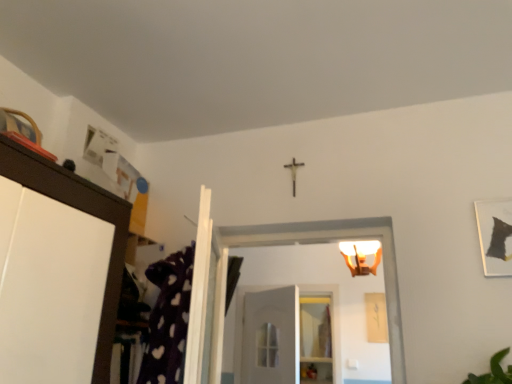
Question: Considering the positions of matte black picture frame at upper right and white matte door at center in the image, is matte black picture frame at upper right wider or thinner than white matte door at center?

Choices:
 (A) wide
 (B) thin

Answer: (B)

Question: Is matte black picture frame at upper right in front of or behind white matte door at center in the image?

Choices:
 (A) front
 (B) behind

Answer: (A)

Question: Which is farther from the matte white light fixture at upper center?

Choices:
 (A) matte black picture frame at upper right
 (B) white matte door at center
 (C) clear glass shelf at center

Answer: (A)

Question: Based on their relative distances, which object is nearer to the white matte door at center?

Choices:
 (A) matte white light fixture at upper center
 (B) clear glass shelf at center
 (C) matte black picture frame at upper right

Answer: (B)